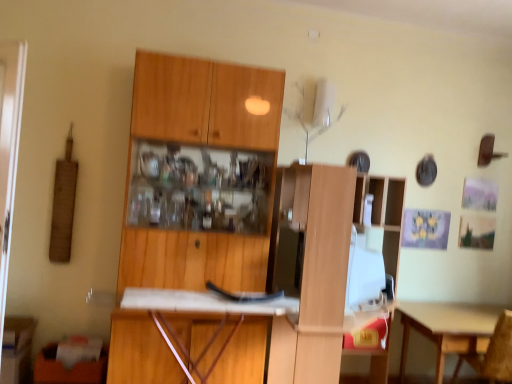
Question: Should I look upward or downward to see light brown wooden table at lower right?

Choices:
 (A) down
 (B) up

Answer: (A)

Question: Is wooden cabinet at lower left, the 2th cabinetry when ordered from right to left, a part of white matte desk at center?

Choices:
 (A) no
 (B) yes

Answer: (A)

Question: Is white matte desk at center to the left of wooden cabinet at lower left, which ranks as the 1th cabinetry in left-to-right order, from the viewer's perspective?

Choices:
 (A) no
 (B) yes

Answer: (A)

Question: Considering the relative sizes of white matte desk at center and wooden cabinet at lower left, the 2th cabinetry when ordered from right to left, in the image provided, is white matte desk at center smaller than wooden cabinet at lower left, the 2th cabinetry when ordered from right to left,?

Choices:
 (A) no
 (B) yes

Answer: (A)

Question: Considering the relative sizes of white matte desk at center and wooden cabinet at lower left, the 2th cabinetry when ordered from right to left, in the image provided, is white matte desk at center bigger than wooden cabinet at lower left, the 2th cabinetry when ordered from right to left,?

Choices:
 (A) yes
 (B) no

Answer: (A)

Question: Is the depth of white matte desk at center greater than that of wooden cabinet at lower left, which ranks as the 1th cabinetry in left-to-right order?

Choices:
 (A) yes
 (B) no

Answer: (B)

Question: Is white matte desk at center not close to wooden cabinet at lower left, which ranks as the 1th cabinetry in left-to-right order?

Choices:
 (A) no
 (B) yes

Answer: (A)

Question: Is light brown wooden table at lower right thinner than wooden cabinet at center, the first cabinetry from the right?

Choices:
 (A) no
 (B) yes

Answer: (A)

Question: Is light brown wooden table at lower right to the right of wooden cabinet at center, the first cabinetry from the right, from the viewer's perspective?

Choices:
 (A) no
 (B) yes

Answer: (B)

Question: From the image's perspective, is light brown wooden table at lower right located above wooden cabinet at center, the first cabinetry from the right?

Choices:
 (A) no
 (B) yes

Answer: (A)

Question: Is light brown wooden table at lower right far away from wooden cabinet at center, arranged as the second cabinetry when viewed from the left?

Choices:
 (A) yes
 (B) no

Answer: (A)

Question: Is light brown wooden table at lower right bigger than wooden cabinet at center, the first cabinetry from the right?

Choices:
 (A) no
 (B) yes

Answer: (A)

Question: Is light brown wooden table at lower right oriented towards wooden cabinet at center, the first cabinetry from the right?

Choices:
 (A) yes
 (B) no

Answer: (B)

Question: Is wooden chair at lower right positioned with its back to light brown wooden table at lower right?

Choices:
 (A) yes
 (B) no

Answer: (A)